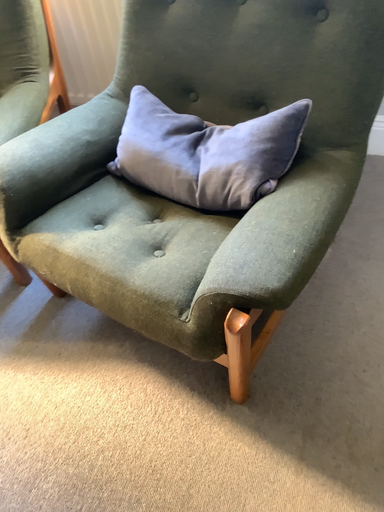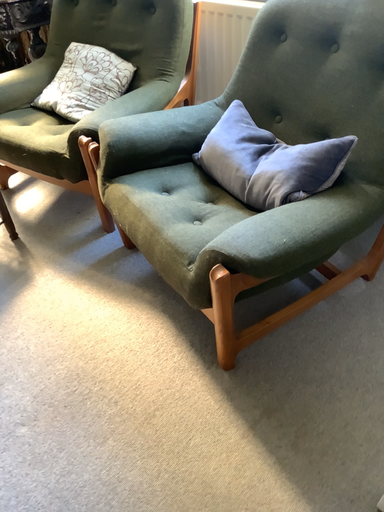
Question: How did the camera likely rotate when shooting the video?

Choices:
 (A) rotated right
 (B) rotated left

Answer: (B)